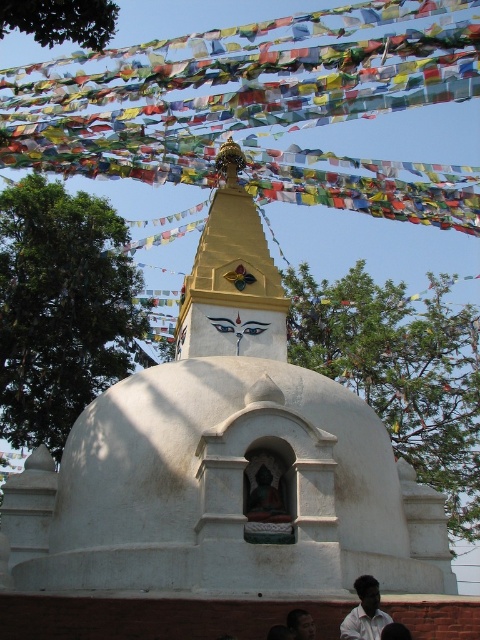
You are an architect designing a new Buddhist temple and want to ensure proper proportions between the matte gold statue at center and the dark skin human face at lower center. Based on the image, which object is shorter?

The matte gold statue at center is shorter than the dark skin human face at lower center.

You are observing a stupa with a golden spire and a Buddha statue. There is a white shirt at lower right and a dark skin human face at lower center. Which object is taller?

The dark skin human face at lower center is taller than the white shirt at lower right.